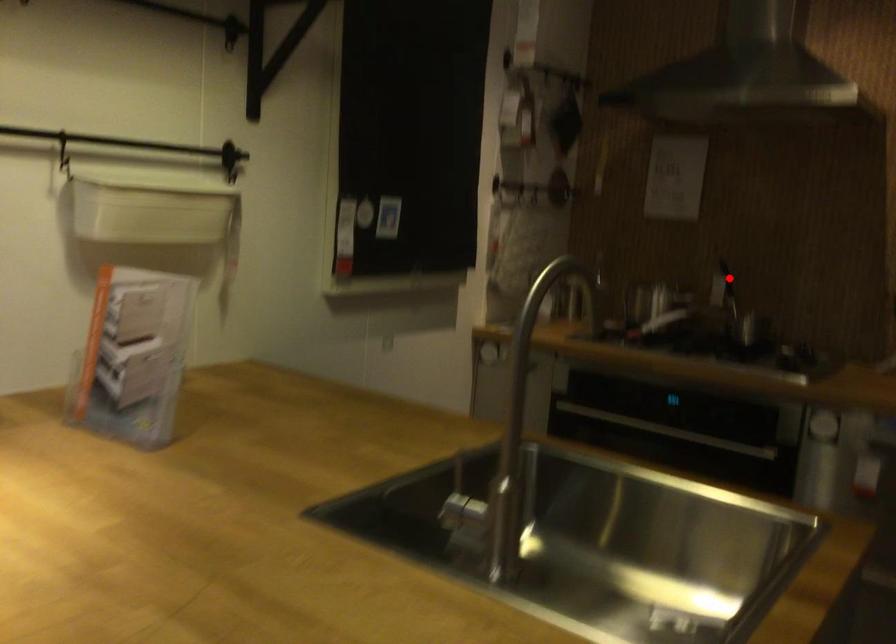
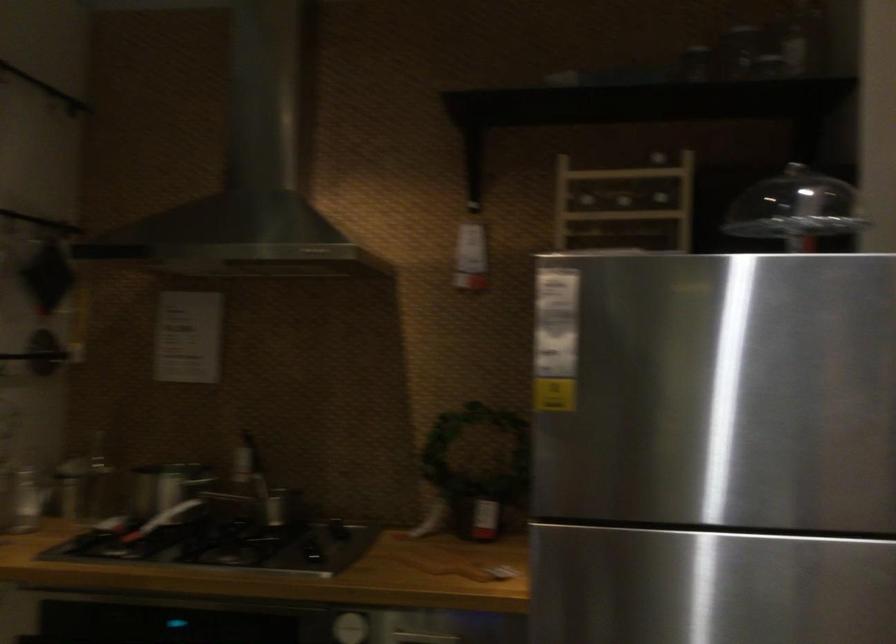
Question: A red point is marked in image1. In image2, is the corresponding 3D point closer to the camera or farther? Reply with the corresponding letter.

Choices:
 (A) The corresponding 3D point is closer.
 (B) The corresponding 3D point is farther.

Answer: (A)